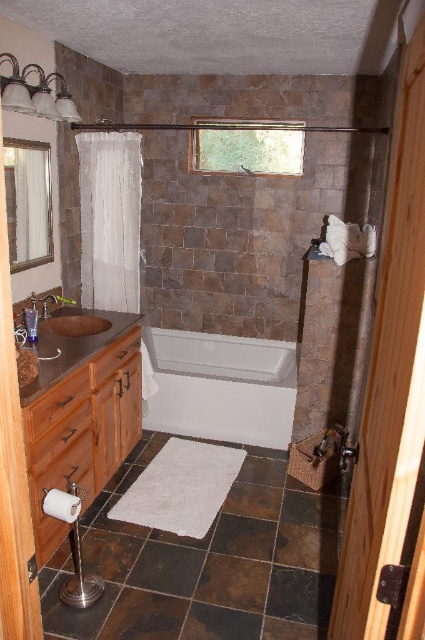
Does brown textured tile at lower center come behind matte brown sink at lower left?

No, brown textured tile at lower center is in front of matte brown sink at lower left.

Who is more forward, (232, 593) or (78, 316)?

Point (232, 593) is more forward.

Image resolution: width=425 pixels, height=640 pixels. I want to click on brown textured tile at lower center, so click(x=234, y=580).

In the scene shown: Which of these two, brown wood vanity at left or white glossy bathtub at center, stands taller?

brown wood vanity at left

Is point (73, 442) farther from camera compared to point (260, 422)?

That is False.

Does point (59, 422) lie behind point (172, 337)?

No, (59, 422) is in front of (172, 337).

This screenshot has height=640, width=425. What are the coordinates of `brown wood vanity at left` in the screenshot? It's located at (81, 416).

What do you see at coordinates (81, 416) in the screenshot? Image resolution: width=425 pixels, height=640 pixels. I see `brown wood vanity at left` at bounding box center [81, 416].

Find the location of a particular element. Image resolution: width=425 pixels, height=640 pixels. brown wood vanity at left is located at coordinates point(81,416).